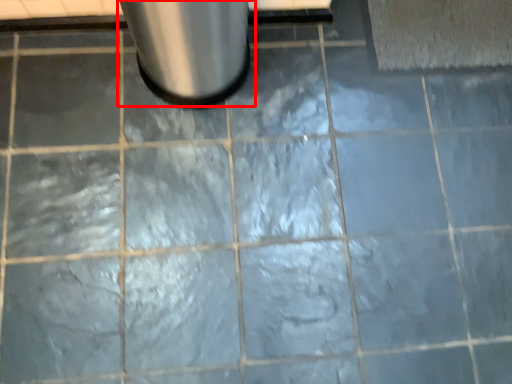
Question: From the image's perspective, where is waste container (annotated by the red box) located relative to bath mat?

Choices:
 (A) below
 (B) above

Answer: (A)